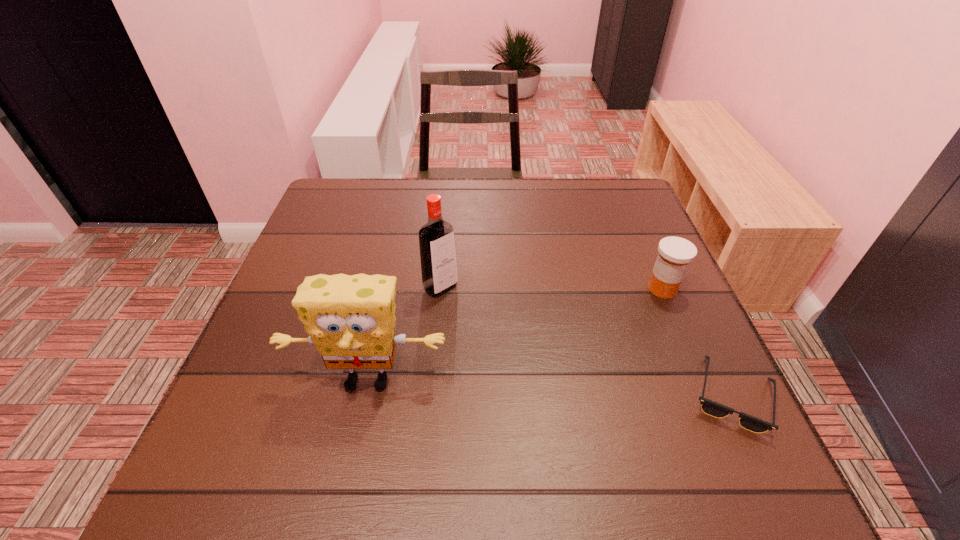
This screenshot has height=540, width=960. I want to click on sponge, so click(351, 319).

Where is `sunglasses`? The height and width of the screenshot is (540, 960). sunglasses is located at coordinates (709, 407).

This screenshot has height=540, width=960. Identify the location of vodka. (436, 237).

Locate an element on the screen. The image size is (960, 540). medicine is located at coordinates (675, 254).

The width and height of the screenshot is (960, 540). What are the coordinates of `vacant space located on the face of the sponge` in the screenshot? It's located at (356, 433).

What are the coordinates of `vacant point located 0.050m on the front and back of the vodka` in the screenshot? It's located at (465, 309).

This screenshot has height=540, width=960. I want to click on vacant space located 0.290m on the front and back of the vodka, so click(544, 382).

Find the location of a particular element. The height and width of the screenshot is (540, 960). vacant space located 0.370m on the front and back of the vodka is located at coordinates (577, 413).

Image resolution: width=960 pixels, height=540 pixels. Identify the location of vacant region located on the label of the second shortest object. (564, 347).

The width and height of the screenshot is (960, 540). I want to click on vacant space located 0.140m on the label of the second shortest object, so click(607, 321).